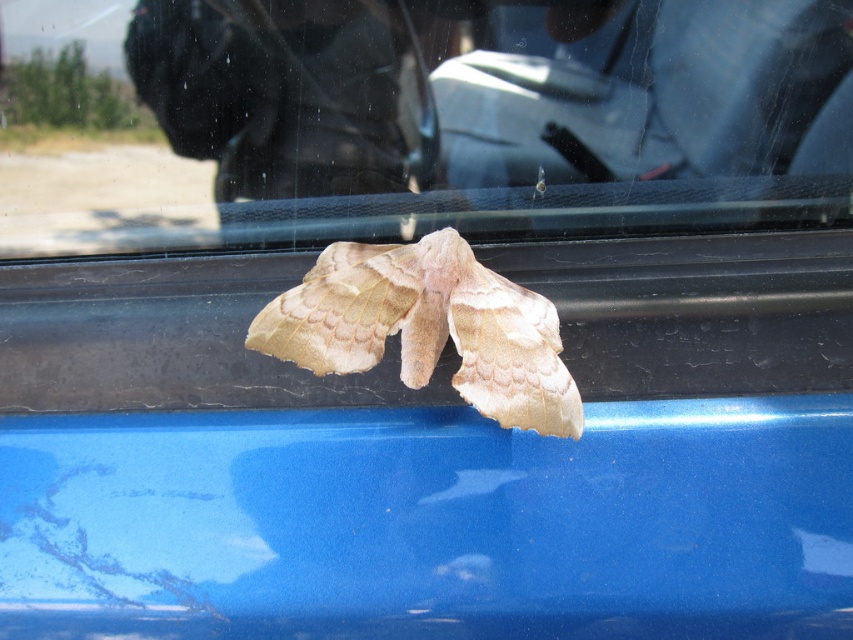
You are standing outside a car and see two points on the window. The first point is at coordinates point(422,179) and the second is at point(555,355). Based on the scene, which point is closer to you?

Point(555,355) is closer to you because the description states that point(422,179) is behind point(555,355), meaning the latter is nearer to your viewpoint.

You are a driver looking at the car window. You see two moths on the window, a transparent glass moth at center and a fuzzy beige moth at center. Which one is closer to the outside of the car?

The transparent glass moth at center is closer to the outside of the car because it is positioned above the fuzzy beige moth at center.

You are a scientist observing two moths on a car window. You have a ruler and need to measure their sizes. Which of the two moths, the transparent glass moth at center or the fuzzy beige moth at center, would you expect to measure as taller?

The transparent glass moth at center has a greater height compared to the fuzzy beige moth at center, so you would expect the transparent glass moth at center to be taller.